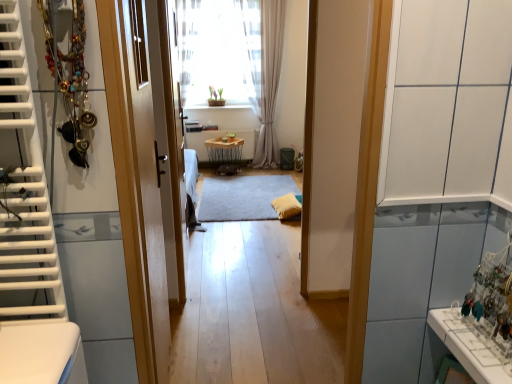
This screenshot has width=512, height=384. I want to click on unoccupied area behind transparent plastic screen door at center, so click(212, 243).